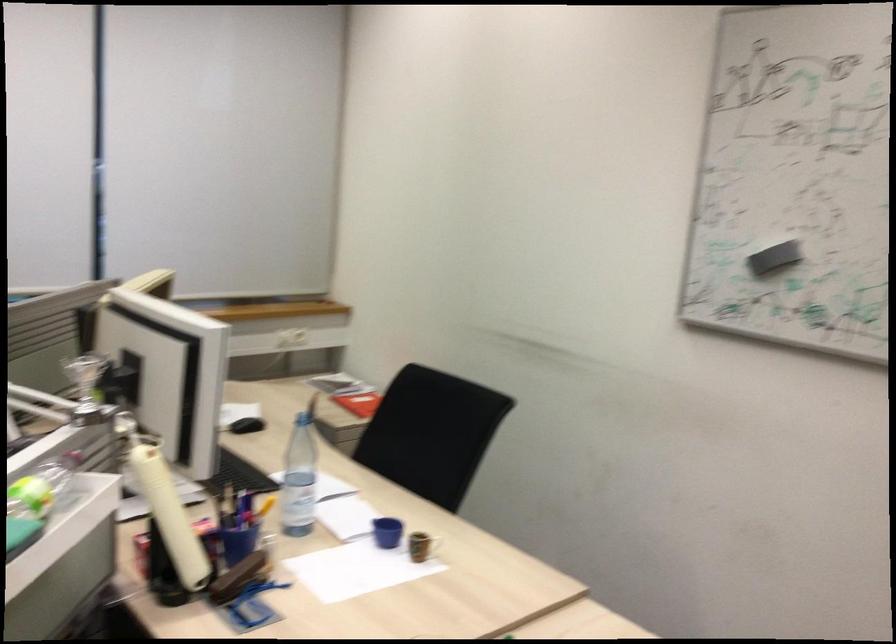
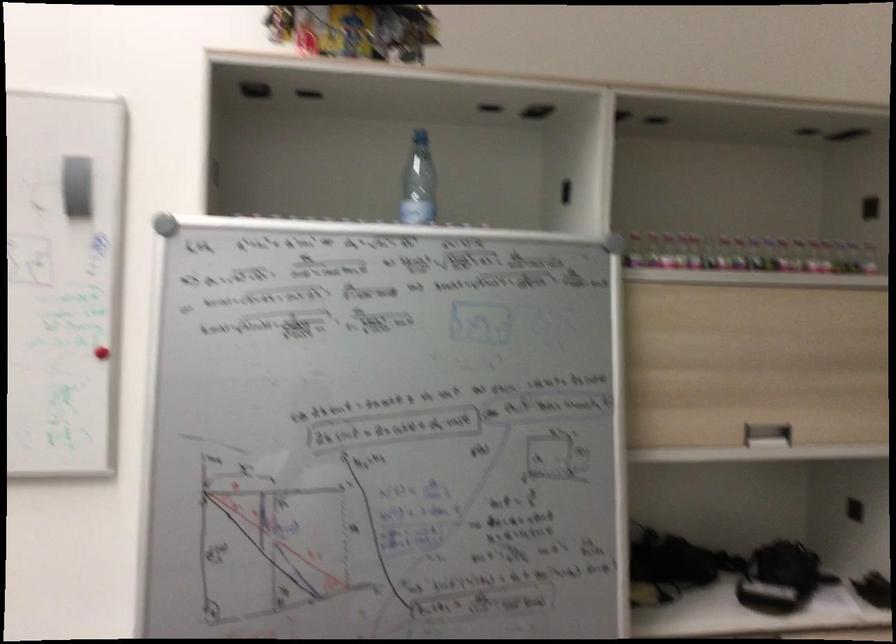
Question: The images are taken continuously from a first-person perspective. In which direction is your viewpoint rotating?

Choices:
 (A) Left
 (B) Right
 (C) Up
 (D) Down

Answer: (B)